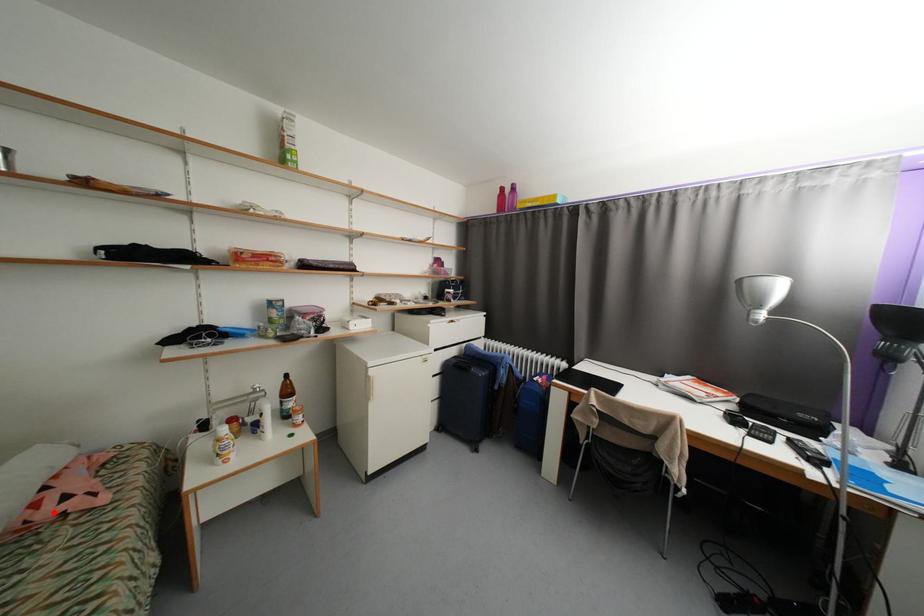
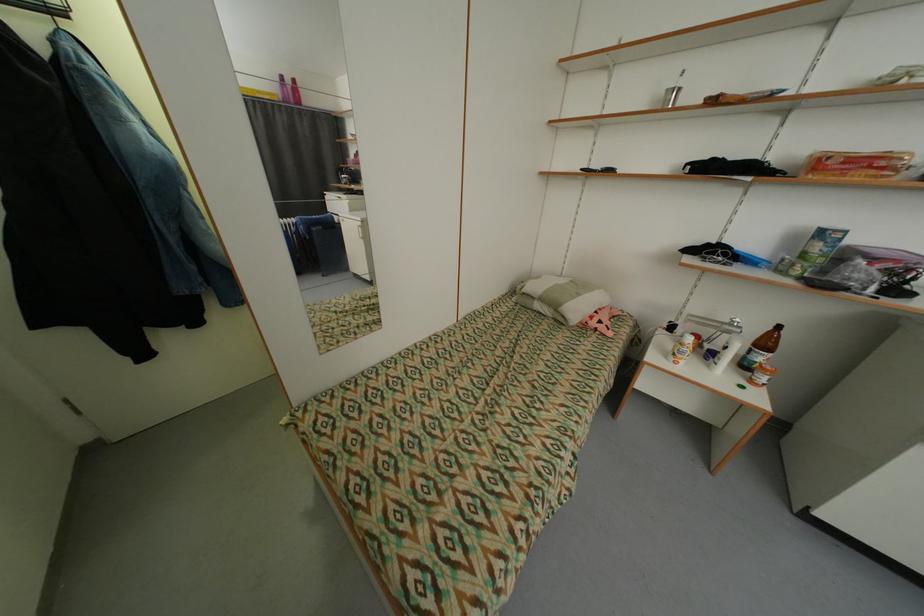
Question: I am providing you with two images of the same scene from different viewpoints. In image1, a red point is highlighted. Considering the same 3D point in image2, which of the following is correct?

Choices:
 (A) It is closer
 (B) It is farther

Answer: (B)